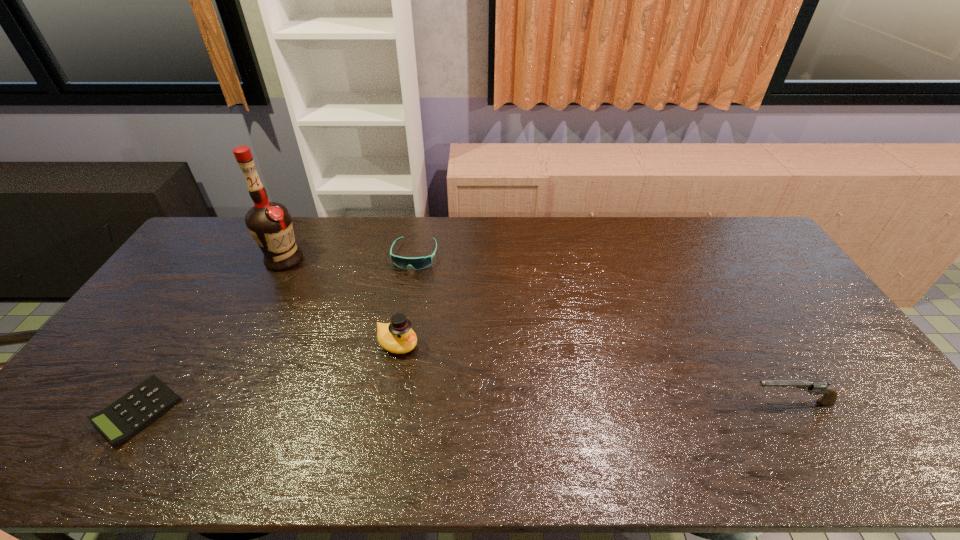
The width and height of the screenshot is (960, 540). Identify the location of free space between the liquor and the third shortest object. (537, 332).

Image resolution: width=960 pixels, height=540 pixels. I want to click on vacant area that lies between the leftmost object and the liquor, so click(x=211, y=335).

Identify the location of free area in between the leftmost object and the third shortest object. (464, 407).

Identify the location of free point between the liquor and the fourth tallest object. The width and height of the screenshot is (960, 540). 349,258.

You are a GUI agent. You are given a task and a screenshot of the screen. Output one action in this format:
    pyautogui.click(x=<x>, y=<y>)
    Task: Click on the free space between the second tallest object and the calculator
    This screenshot has height=540, width=960.
    Given the screenshot: What is the action you would take?
    pyautogui.click(x=268, y=377)

Locate an element on the screen. vacant area between the second shortest object and the rightmost object is located at coordinates (603, 329).

Locate which object is the third closest to the second shortest object. Please provide its 2D coordinates. Your answer should be formatted as a tuple, i.e. [(x, y)], where the tuple contains the x and y coordinates of a point satisfying the conditions above.

[(124, 418)]

Choose which object is the nearest neighbor to the rightmost object. Please provide its 2D coordinates. Your answer should be formatted as a tuple, i.e. [(x, y)], where the tuple contains the x and y coordinates of a point satisfying the conditions above.

[(397, 337)]

The width and height of the screenshot is (960, 540). I want to click on blank area in the image that satisfies the following two spatial constraints: 1. on the back side of the calculator; 2. aiming along the barrel of the rightmost object, so click(x=143, y=402).

Find the location of `free spot that satisfies the following two spatial constraints: 1. on the front side of the tallest object; 2. aiming along the barrel of the third tallest object`. free spot that satisfies the following two spatial constraints: 1. on the front side of the tallest object; 2. aiming along the barrel of the third tallest object is located at coordinates (210, 402).